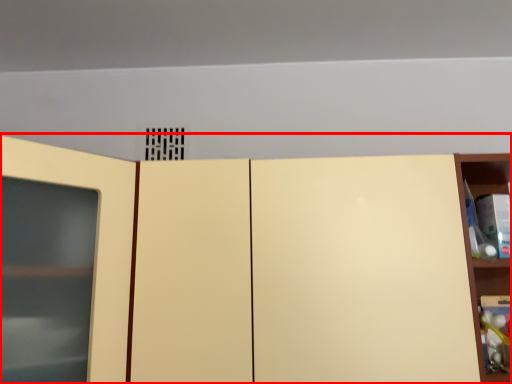
Question: Where is cupboard (annotated by the red box) located in relation to shelf in the image?

Choices:
 (A) right
 (B) left

Answer: (B)